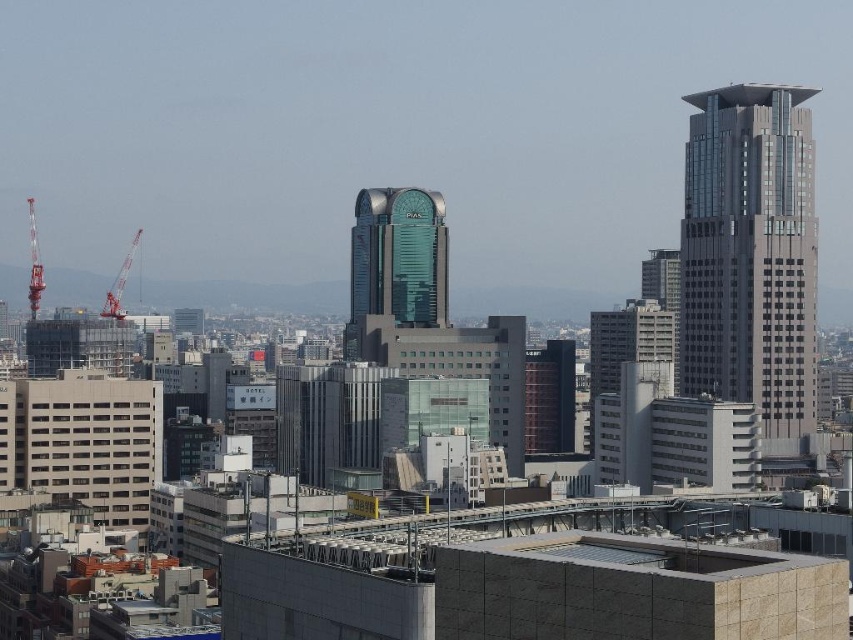
You are an architect observing the cityscape and notice two cranes at the left side of the image. Which crane is positioned higher in the air between the metallic red crane at left and the orange metallic crane at left?

The metallic red crane at left is positioned higher in the air than the orange metallic crane at left because it is located above it.

You are a city planner assessing the skyline. You need to determine if the green glass tower at center will block the view of the metallic red crane at left from a nearby park. Based on their heights, can the crane be seen behind the tower?

The green glass tower at center has a greater height compared to metallic red crane at left, so the crane might be partially or fully obscured depending on their exact positions, but based on height alone, the tower being taller could block the view of the crane from certain angles.